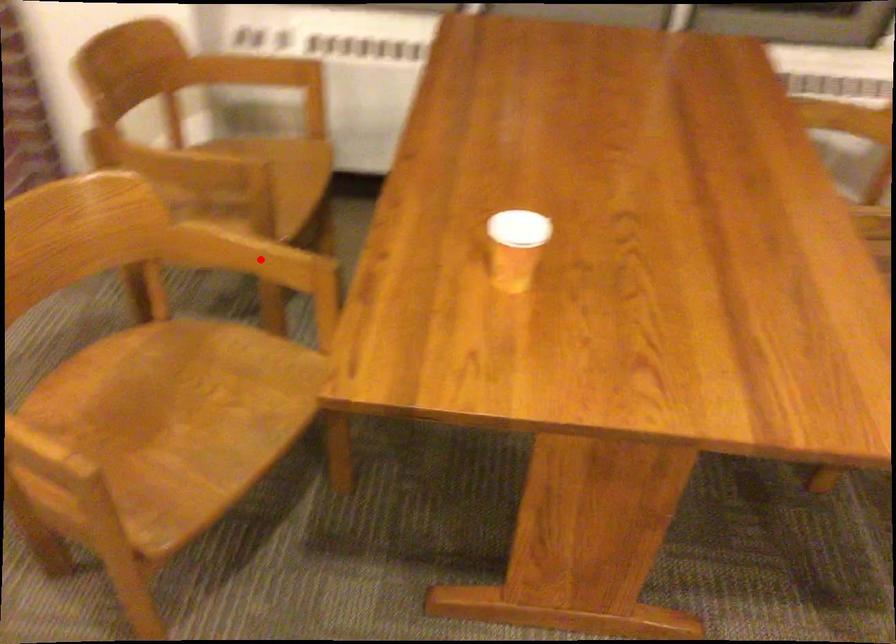
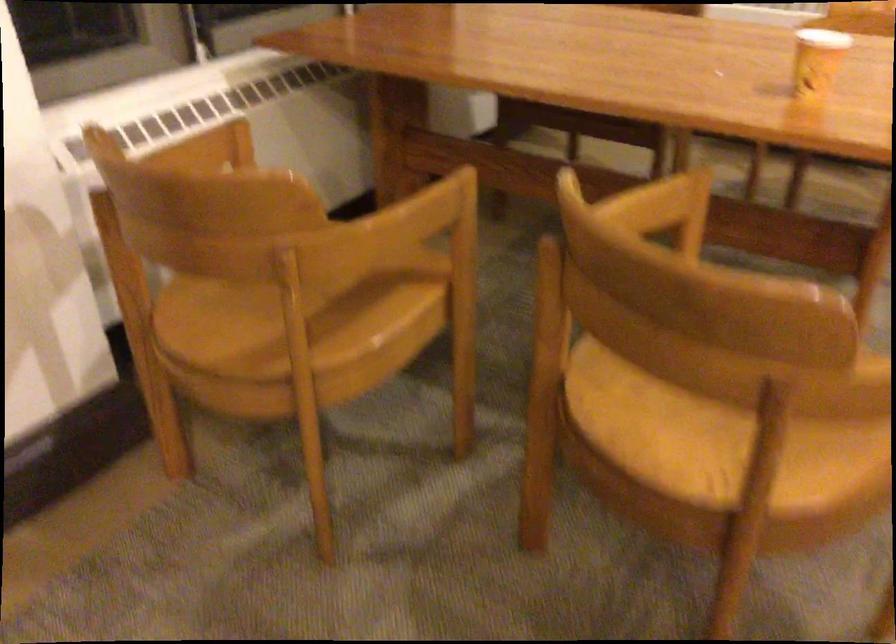
Question: I am providing you with two images of the same scene from different viewpoints. A red point is shown in image1. For the corresponding object point in image2, is it positioned nearer or farther from the camera?

Choices:
 (A) Nearer
 (B) Farther

Answer: (A)